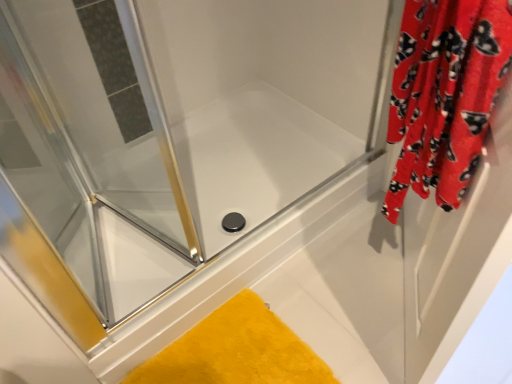
Question: In the image, is red velvet curtain at right positioned in front of or behind yellow plush bath mat at lower center?

Choices:
 (A) front
 (B) behind

Answer: (A)

Question: From the image's perspective, is red velvet curtain at right located above or below yellow plush bath mat at lower center?

Choices:
 (A) below
 (B) above

Answer: (B)

Question: Estimate the real-world distances between objects in this image. Which object is closer to the yellow plush bath mat at lower center?

Choices:
 (A) red fabric curtain at right, the 2th screen door when ordered from left to right
 (B) red velvet curtain at right
 (C) clear glass shower door at upper left, arranged as the second screen door when viewed from the right

Answer: (A)

Question: Estimate the real-world distances between objects in this image. Which object is closer to the clear glass shower door at upper left, arranged as the second screen door when viewed from the right?

Choices:
 (A) red velvet curtain at right
 (B) red fabric curtain at right, acting as the first screen door starting from the right
 (C) yellow plush bath mat at lower center

Answer: (C)